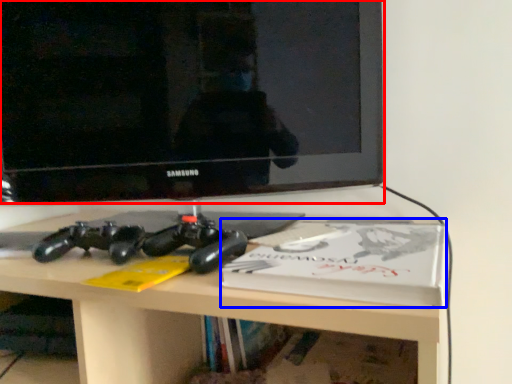
Question: Which point is further to the camera, television (highlighted by a red box) or paperback book (highlighted by a blue box)?

Choices:
 (A) television
 (B) paperback book

Answer: (A)